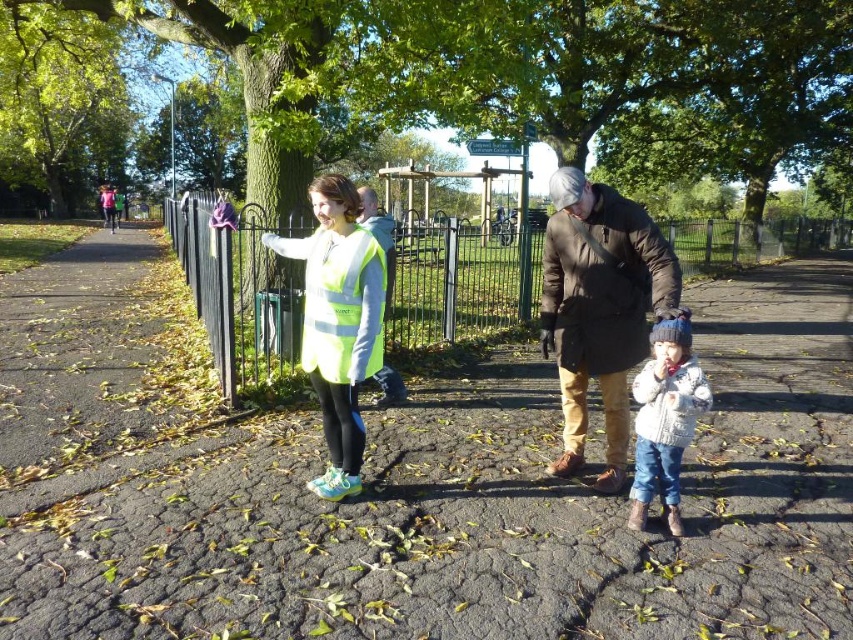
Question: Does smooth asphalt path at center appear over dark brown leather jacket at center?

Choices:
 (A) no
 (B) yes

Answer: (A)

Question: Is smooth asphalt path at center bigger than neon yellow reflective vest at center?

Choices:
 (A) yes
 (B) no

Answer: (A)

Question: Considering the relative positions of green metal fence at center and neon yellow reflective vest at center in the image provided, where is green metal fence at center located with respect to neon yellow reflective vest at center?

Choices:
 (A) left
 (B) right

Answer: (B)

Question: Which of the following is the closest to the observer?

Choices:
 (A) reflective green vest at center
 (B) white knitted sweater at lower right
 (C) yellow reflective safety vest at center

Answer: (B)

Question: Which object is the closest to the green metal fence at center?

Choices:
 (A) dark brown leather jacket at center
 (B) yellow reflective safety vest at center
 (C) reflective green vest at center

Answer: (B)

Question: Which object is the farthest from the dark brown leather jacket at center?

Choices:
 (A) white knitted sweater at lower right
 (B) neon yellow reflective vest at center
 (C) green metal fence at center
 (D) reflective green vest at center

Answer: (C)